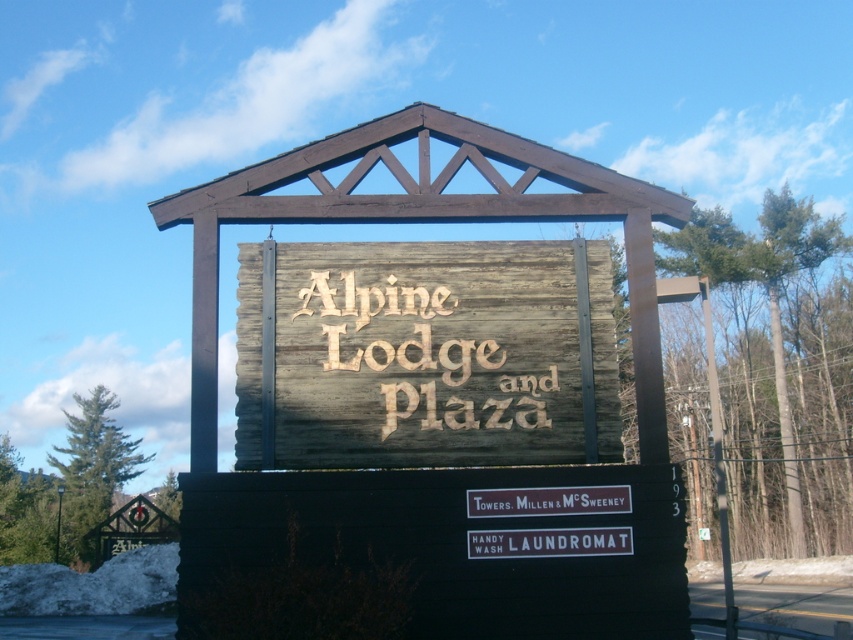
Is weathered wood sign at center closer to the viewer compared to brown wood sign at center?

No, weathered wood sign at center is behind brown wood sign at center.

Is weathered wood sign at center smaller than brown wood sign at center?

Incorrect, weathered wood sign at center is not smaller in size than brown wood sign at center.

Measure the distance between weathered wood sign at center and camera.

weathered wood sign at center is 43.81 feet away from camera.

This screenshot has width=853, height=640. I want to click on weathered wood sign at center, so click(425, 355).